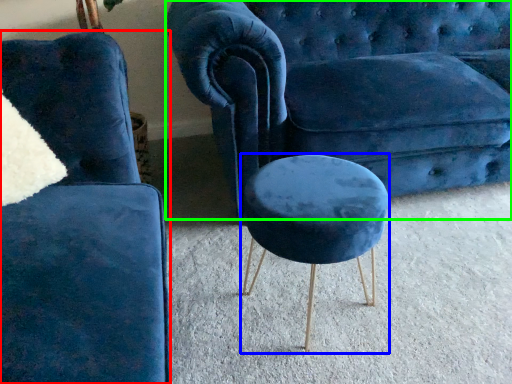
Question: Estimate the real-world distances between objects in this image. Which object is closer to chair (highlighted by a red box), stool (highlighted by a blue box) or studio couch (highlighted by a green box)?

Choices:
 (A) stool
 (B) studio couch

Answer: (A)